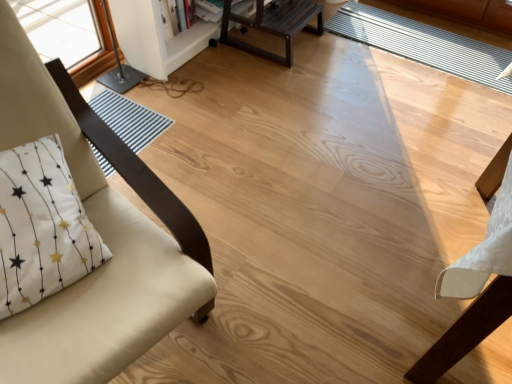
In order to click on free space that is in between dark brown wood table at upper center and white striped mat at center in this screenshot , I will do `click(373, 68)`.